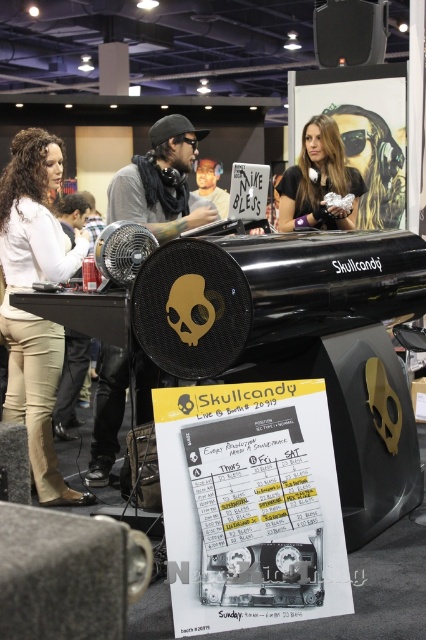
Question: Can you confirm if black matte speaker at lower left is positioned below matte black poster at upper center?

Choices:
 (A) yes
 (B) no

Answer: (A)

Question: Which point is closer to the camera?

Choices:
 (A) (301, 188)
 (B) (374, 205)

Answer: (A)

Question: Can you confirm if black matte speaker at lower left is thinner than black matte speaker at upper center?

Choices:
 (A) no
 (B) yes

Answer: (B)

Question: Which object is closer to the camera taking this photo?

Choices:
 (A) white matte shirt at center
 (B) white paper poster at center
 (C) black matte speaker at upper center

Answer: (B)

Question: Which of these objects is positioned closest to the white matte shirt at center?

Choices:
 (A) black matte speaker at upper center
 (B) matte black headphones at center
 (C) white paper poster at center
 (D) black matte speaker at lower left

Answer: (C)

Question: Is black matte speaker at lower left further to camera compared to matte black poster at upper center?

Choices:
 (A) no
 (B) yes

Answer: (A)